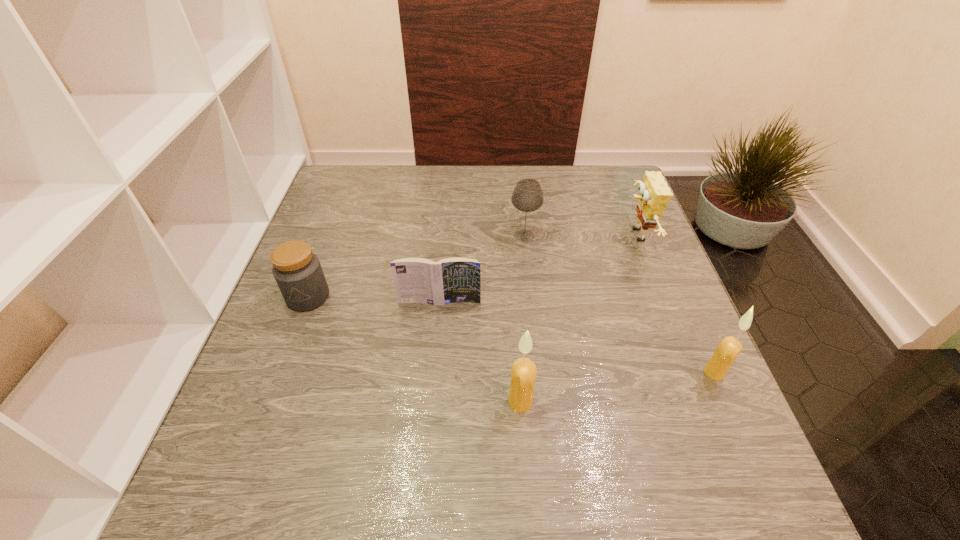
Image resolution: width=960 pixels, height=540 pixels. In order to click on the left candle in this screenshot , I will do `click(523, 374)`.

Find the location of a particular element. The width and height of the screenshot is (960, 540). the nearer candle is located at coordinates (523, 374).

Where is `the farther candle`? Image resolution: width=960 pixels, height=540 pixels. the farther candle is located at coordinates (728, 349).

In order to click on the shorter candle in this screenshot , I will do `click(728, 349)`.

Where is `sponge`? sponge is located at coordinates (x=654, y=195).

This screenshot has width=960, height=540. Find the location of `book`. book is located at coordinates (417, 280).

Locate an element on the screen. Image resolution: width=960 pixels, height=540 pixels. jar is located at coordinates (297, 270).

This screenshot has width=960, height=540. I want to click on wineglass, so click(527, 196).

The width and height of the screenshot is (960, 540). Find the location of `free space located on the left of the left candle`. free space located on the left of the left candle is located at coordinates (401, 402).

The height and width of the screenshot is (540, 960). Identify the location of vacant space positioned on the back of the fifth farthest object. (688, 314).